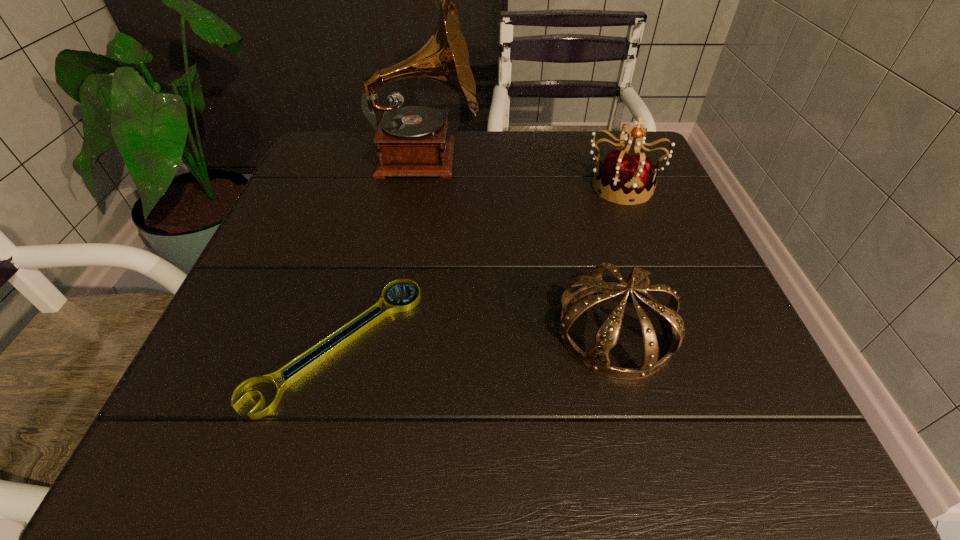
The image size is (960, 540). Identify the location of vacant area between the shorter tiara and the phonograph_record. (520, 245).

The height and width of the screenshot is (540, 960). Identify the location of free spot between the wrench and the phonograph_record. (381, 251).

Locate an element on the screen. The width and height of the screenshot is (960, 540). vacant area that lies between the shorter tiara and the phonograph_record is located at coordinates (520, 245).

Image resolution: width=960 pixels, height=540 pixels. Find the location of `vacant space in between the tallest object and the taller tiara`. vacant space in between the tallest object and the taller tiara is located at coordinates (523, 172).

Identify which object is located as the third nearest to the phonograph_record. Please provide its 2D coordinates. Your answer should be formatted as a tuple, i.e. [(x, y)], where the tuple contains the x and y coordinates of a point satisfying the conditions above.

[(596, 359)]

The height and width of the screenshot is (540, 960). What are the coordinates of `object that stands as the closest to the shorter tiara` in the screenshot? It's located at (296, 368).

You are a GUI agent. You are given a task and a screenshot of the screen. Output one action in this format:
    pyautogui.click(x=<x>, y=<y>)
    Task: Click on the vacant region that satisfies the following two spatial constraints: 1. on the horn of the phonograph_record; 2. on the front side of the shortest object
    The width and height of the screenshot is (960, 540).
    Given the screenshot: What is the action you would take?
    pyautogui.click(x=396, y=343)

Where is `blank area in the image that satisfies the following two spatial constraints: 1. on the horn of the tallest object; 2. on the left side of the second shortest object`? The image size is (960, 540). blank area in the image that satisfies the following two spatial constraints: 1. on the horn of the tallest object; 2. on the left side of the second shortest object is located at coordinates (397, 332).

I want to click on vacant position in the image that satisfies the following two spatial constraints: 1. on the horn of the third tallest object; 2. on the right side of the tallest object, so 397,332.